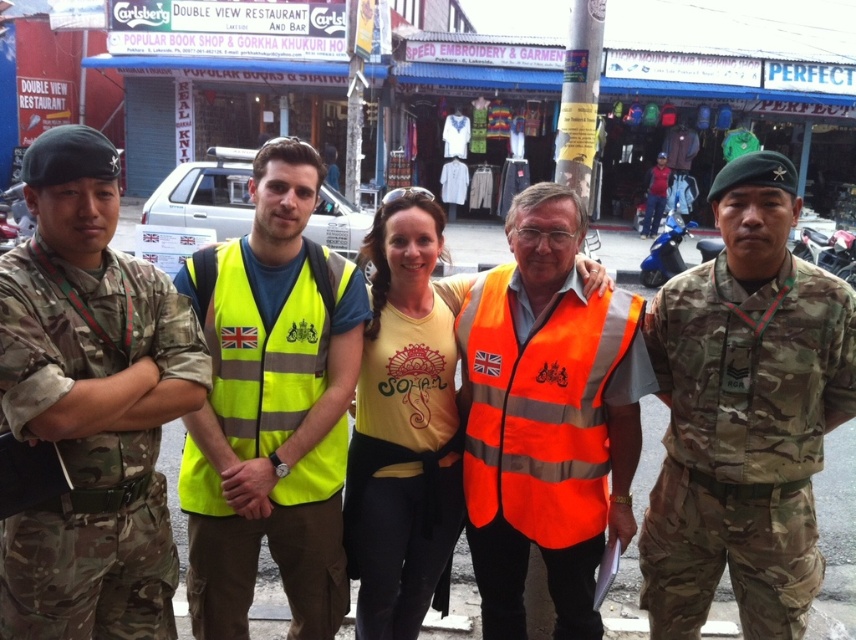
You are a photographer trying to capture both the camouflage uniform at left and the camouflage uniform at center in a single frame. Which camouflage uniform should you focus on to ensure both are in the frame without zooming?

The camouflage uniform at left is smaller than the camouflage uniform at center, so focusing on the camouflage uniform at center would allow both to be captured in the frame without zooming.

You are a photographer positioned at the center of the scene. You need to capture a photo that includes both the camouflage uniform at left and the nearest storefront sign to the right of it. Which storefront sign should you aim for?

The camouflage uniform at left is located at point (90, 404). The nearest storefront sign to the right of it would be the first sign visible to the right, which is the Carlsberg Double View Restaurant sign. Therefore, you should aim for the Carlsberg Double View Restaurant sign to include both the camouflage uniform at left and the sign in the photo.

You are standing in the commercial area shown in the image and want to move from the point at coordinates point (114, 522) to the point at coordinates point (432, 563). Which direction should you face to walk towards the second point?

Since point (114, 522) is closer to the viewer than point (432, 563), you should face away from the viewer to walk towards the second point.